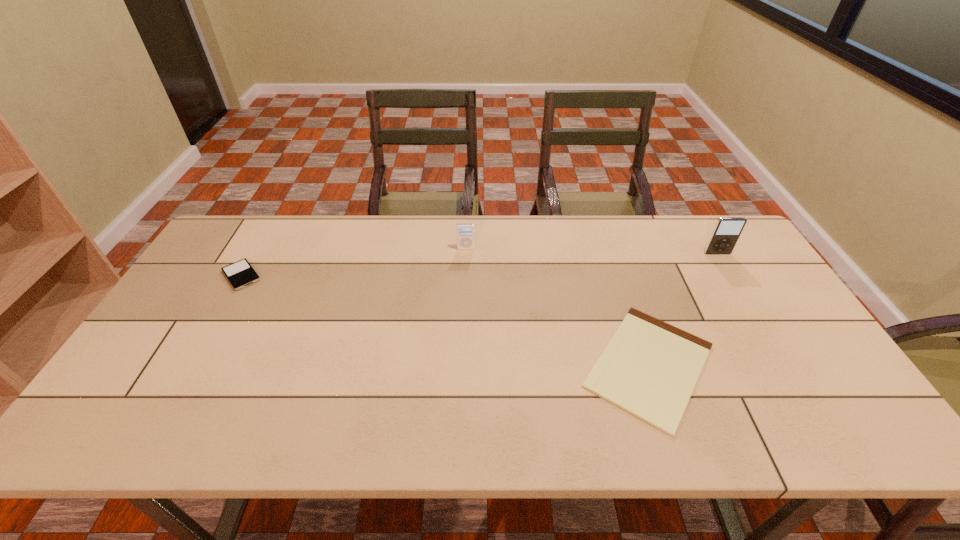
This screenshot has width=960, height=540. I want to click on free location located 0.360m on the front of the third farthest object, so click(170, 399).

The image size is (960, 540). I want to click on free region located 0.360m on the back of the nearest object, so click(x=604, y=232).

Locate an element on the screen. object that is at the near edge is located at coordinates (649, 369).

Where is `object present at the left edge`? The width and height of the screenshot is (960, 540). object present at the left edge is located at coordinates (x=240, y=274).

At what (x,y) coordinates should I click in order to perform the action: click on object that is at the right edge. Please return your answer as a coordinate pair (x, y). The height and width of the screenshot is (540, 960). Looking at the image, I should click on (725, 235).

I want to click on object that is at the far right corner, so click(725, 235).

Identify the location of vacant space at the far edge of the desktop. (639, 249).

Identify the location of free point at the near edge. The height and width of the screenshot is (540, 960). (530, 417).

Locate an element on the screen. The width and height of the screenshot is (960, 540). vacant space at the left edge is located at coordinates (201, 295).

In the image, there is a desktop. Where is `free space at the right edge`? This screenshot has width=960, height=540. free space at the right edge is located at coordinates (748, 268).